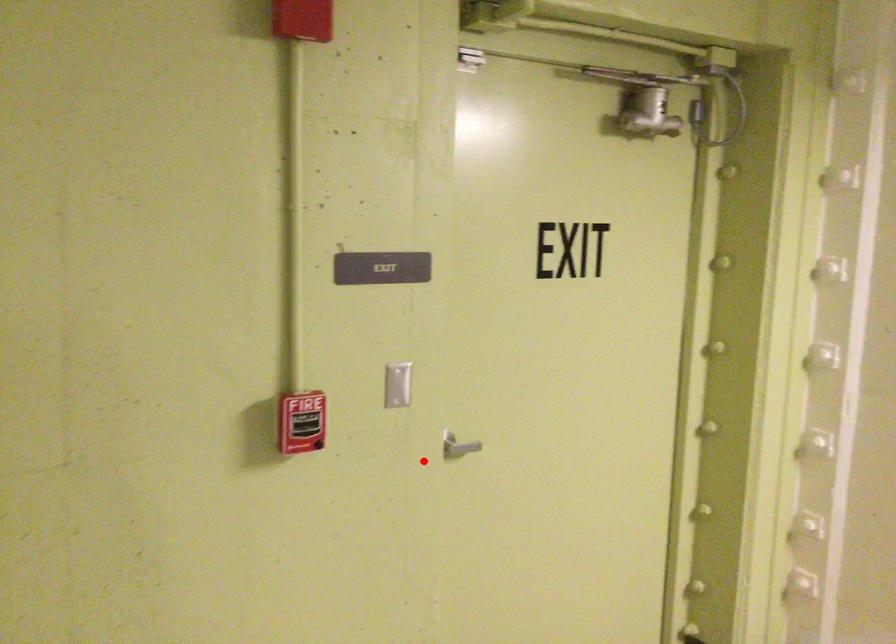
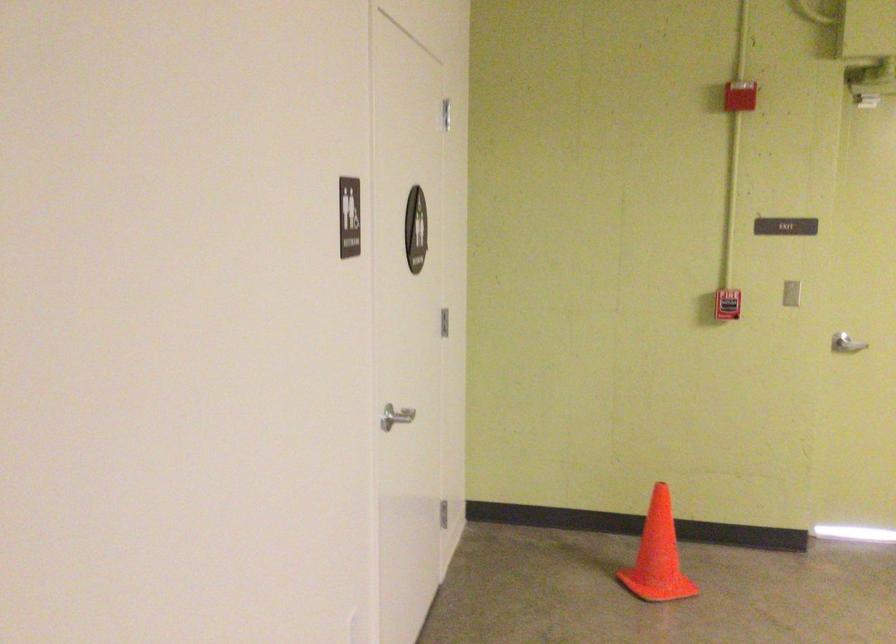
In the second image, find the point that corresponds to the highlighted location in the first image.

(846, 344)